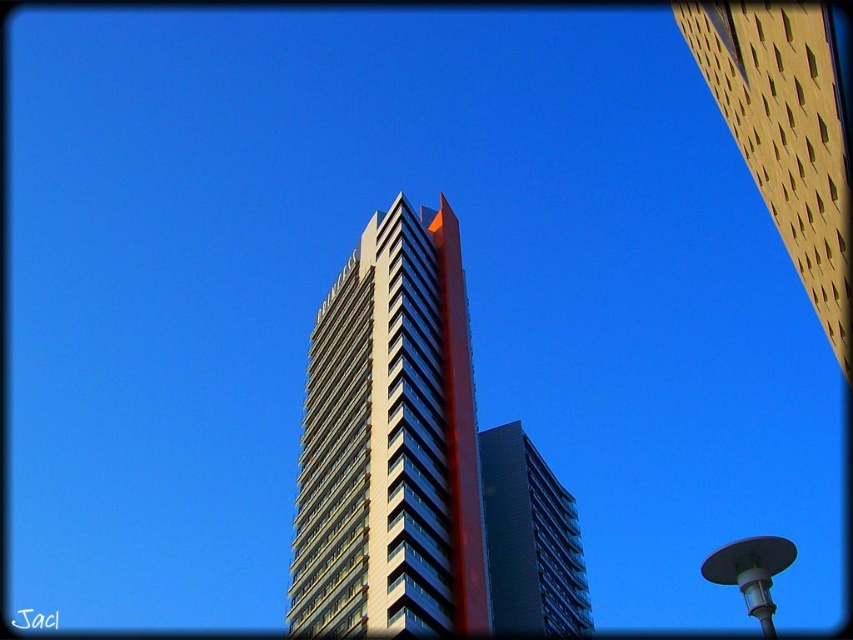
Question: Which object is the farthest from the dark gray glass building at center?

Choices:
 (A) gold textured building at upper right
 (B) sleek glass tower at center

Answer: (A)

Question: Does gold textured building at upper right have a greater width compared to dark gray glass building at center?

Choices:
 (A) no
 (B) yes

Answer: (B)

Question: Does gold textured building at upper right come in front of dark gray glass building at center?

Choices:
 (A) yes
 (B) no

Answer: (A)

Question: Which point is farther to the camera?

Choices:
 (A) gold textured building at upper right
 (B) dark gray glass building at center

Answer: (B)

Question: Considering the real-world distances, which object is farthest from the dark gray glass building at center?

Choices:
 (A) sleek glass tower at center
 (B) gold textured building at upper right

Answer: (B)

Question: Is gold textured building at upper right bigger than dark gray glass building at center?

Choices:
 (A) yes
 (B) no

Answer: (B)